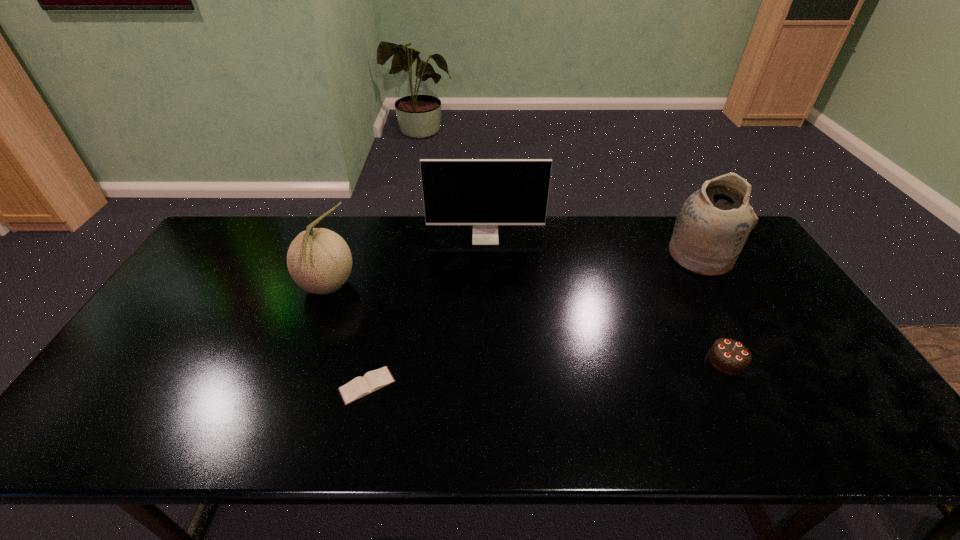
The height and width of the screenshot is (540, 960). I want to click on the third object from right to left, so click(485, 193).

Where is `pottery`? pottery is located at coordinates (713, 224).

Locate an element on the screen. cantaloup is located at coordinates (319, 260).

This screenshot has height=540, width=960. What are the coordinates of `chocolate cake` in the screenshot? It's located at (730, 356).

Image resolution: width=960 pixels, height=540 pixels. I want to click on the shortest object, so click(372, 381).

Where is `diary`? This screenshot has width=960, height=540. diary is located at coordinates (372, 381).

Where is `vacant space located 0.370m on the front-facing side of the monitor`? The height and width of the screenshot is (540, 960). vacant space located 0.370m on the front-facing side of the monitor is located at coordinates (487, 327).

In order to click on vacant space located on the left of the pottery in this screenshot , I will do `click(609, 256)`.

Identify the location of free location located 0.360m on the left of the leftmost object. This screenshot has height=540, width=960. (179, 287).

Where is `free spot located on the right of the chocolate cake`? The image size is (960, 540). free spot located on the right of the chocolate cake is located at coordinates (807, 361).